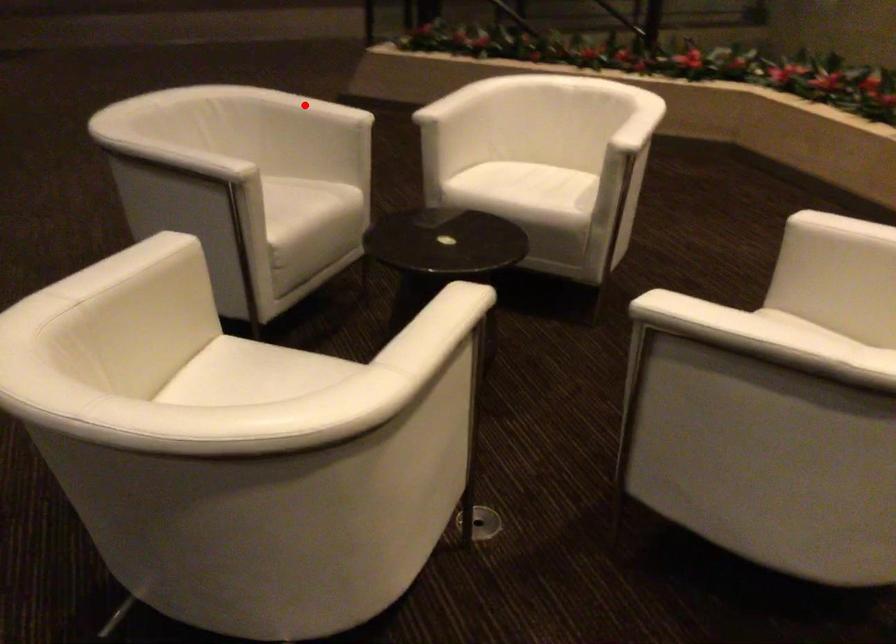
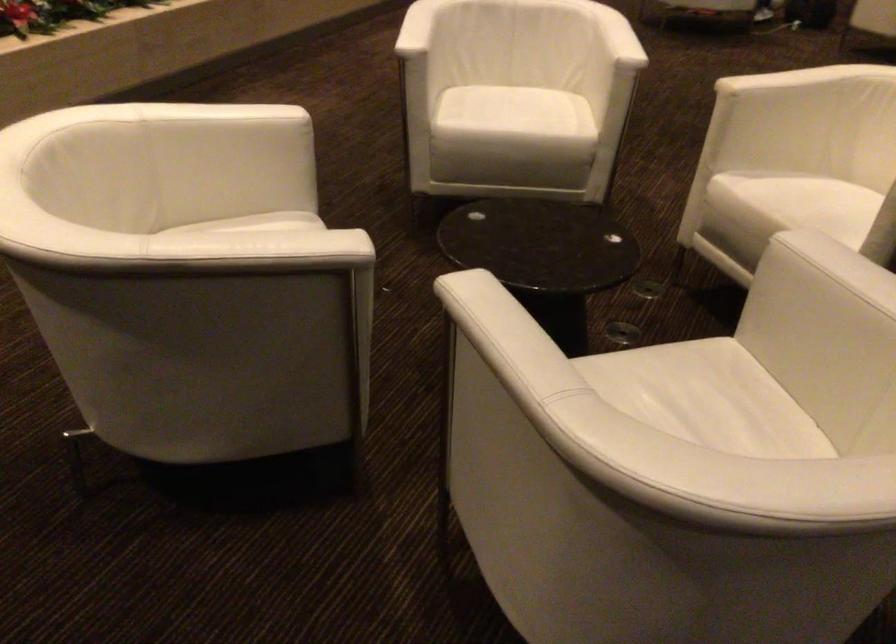
Question: A red point is marked in image1. In image2, is the corresponding 3D point closer to the camera or farther? Reply with the corresponding letter.

Choices:
 (A) The corresponding 3D point is closer.
 (B) The corresponding 3D point is farther.

Answer: (A)